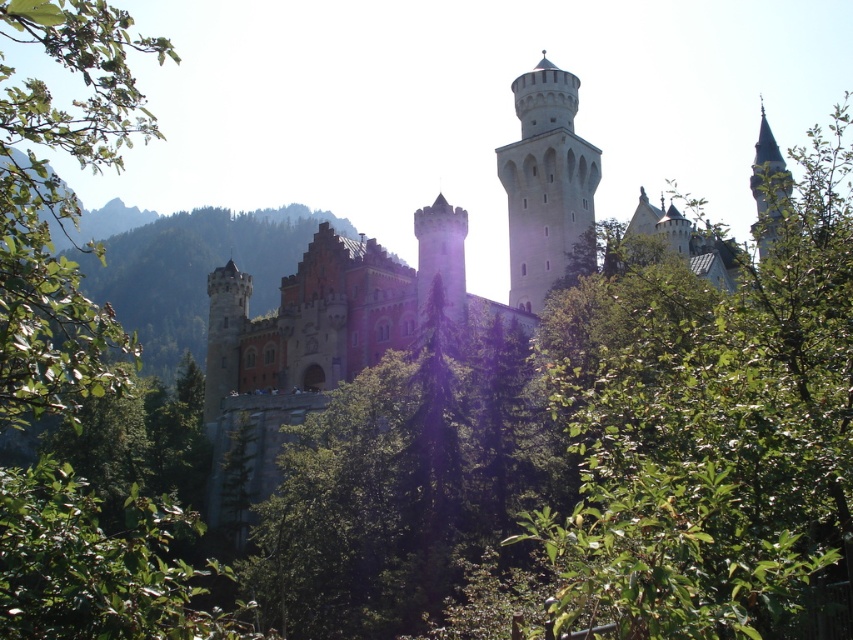
You are a visitor standing in the castle courtyard. You notice the red brick castle at center and the smooth stone tower at center. Which structure would appear closer to you based on their sizes?

The red brick castle at center appears closer because it has a larger size compared to the smooth stone tower at center.

You are standing in front of the castle and notice two points marked in the image. The first point is at coordinates point (94, 390), and the second is at point (537, 237). Which point is nearer to you?

Point (94, 390) is closer to the viewer than point (537, 237).